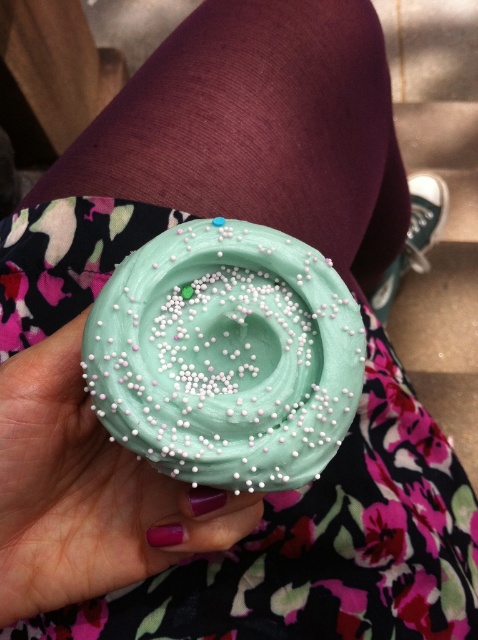
Can you confirm if teal frosting cupcake at center is positioned to the left of matte teal cupcake at center?

In fact, teal frosting cupcake at center is to the right of matte teal cupcake at center.

Is teal frosting cupcake at center thinner than matte teal cupcake at center?

No.

What do you see at coordinates (227, 355) in the screenshot? I see `teal frosting cupcake at center` at bounding box center [227, 355].

Image resolution: width=478 pixels, height=640 pixels. What are the coordinates of `teal frosting cupcake at center` in the screenshot? It's located at (227, 355).